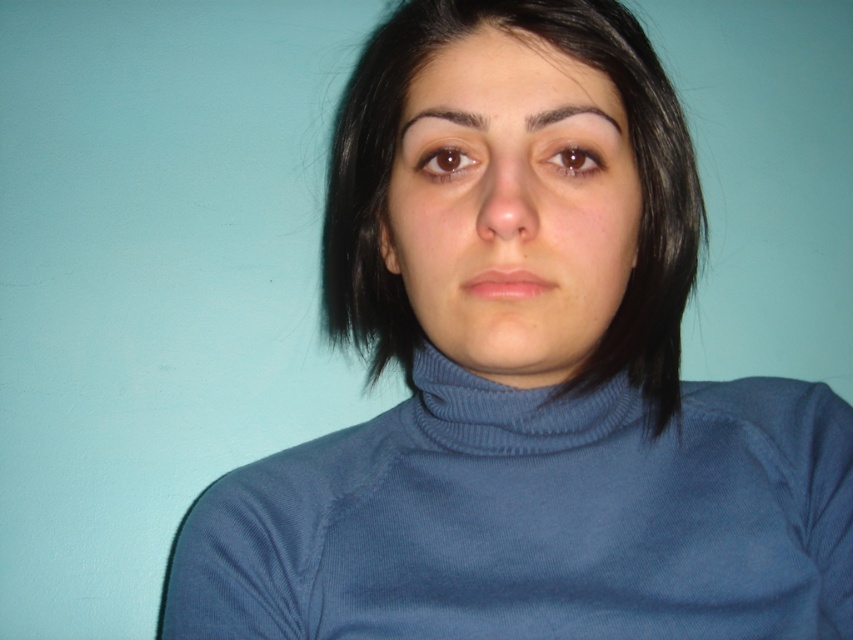
Question: From the image, what is the correct spatial relationship of matte blue turtleneck at center in relation to dark brown hair at upper center?

Choices:
 (A) below
 (B) above

Answer: (A)

Question: Which of the following is the closest to the observer?

Choices:
 (A) dark brown hair at upper center
 (B) blue ribbed polo neck at center

Answer: (A)

Question: Does blue ribbed polo neck at center appear over dark brown hair at upper center?

Choices:
 (A) no
 (B) yes

Answer: (A)

Question: Which object is positioned closest to the blue ribbed polo neck at center?

Choices:
 (A) matte blue turtleneck at center
 (B) brownhaireyebrow at upper center
 (C) dark brown hair at upper center

Answer: (A)

Question: Which of these objects is positioned closest to the dark brown hair at upper center?

Choices:
 (A) blue ribbed polo neck at center
 (B) brownhaireyebrow at upper center

Answer: (B)

Question: Can you confirm if matte blue turtleneck at center is positioned below dark brown hair at upper center?

Choices:
 (A) yes
 (B) no

Answer: (A)